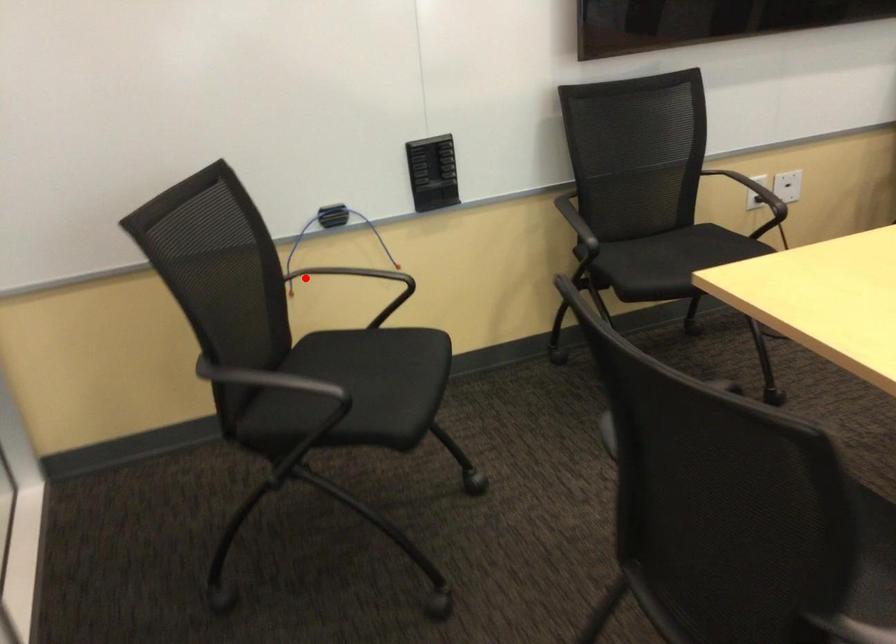
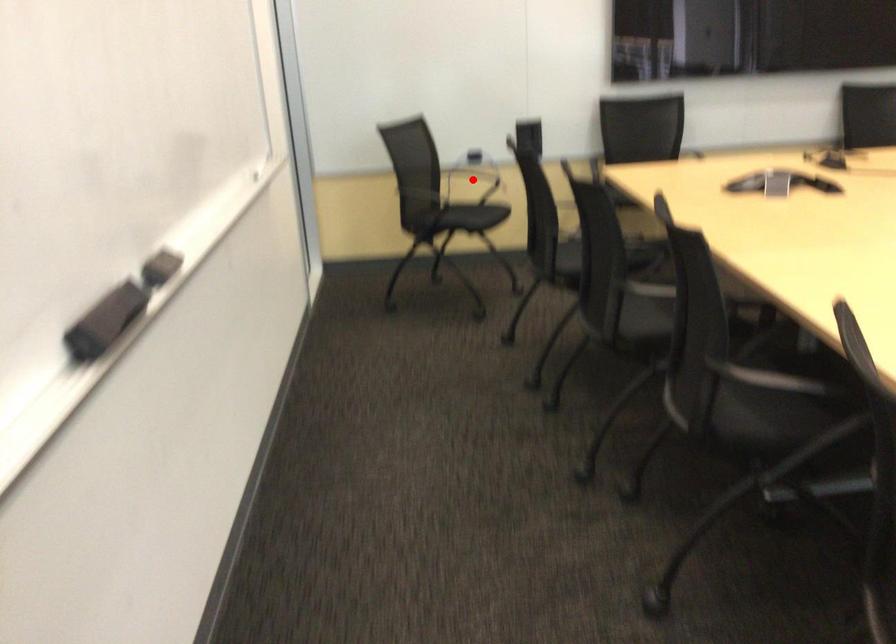
I am providing you with two images of the same scene from different viewpoints. A red point is marked on the first image and another point is marked on the second image. Does the point marked in image1 correspond to the same location as the one in image2?

Yes